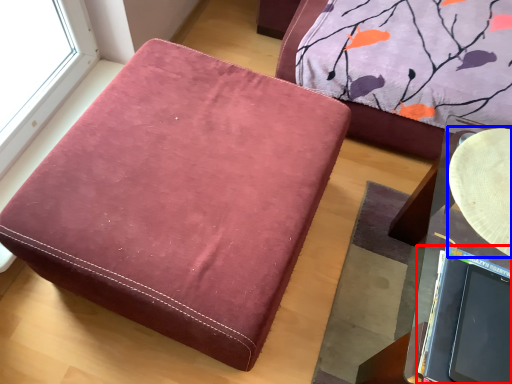
Question: Among these objects, which one is farthest to the camera, laptop (highlighted by a red box) or round table (highlighted by a blue box)?

Choices:
 (A) laptop
 (B) round table

Answer: (B)